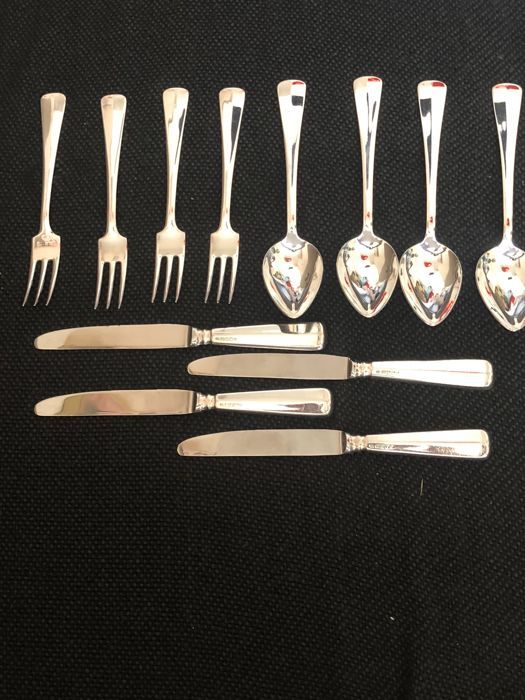
You are a GUI agent. You are given a task and a screenshot of the screen. Output one action in this format:
    pyautogui.click(x=<x>, y=<y>)
    Task: Click on the knives
    The width and height of the screenshot is (525, 700).
    Given the screenshot: What is the action you would take?
    pyautogui.click(x=131, y=396), pyautogui.click(x=253, y=446), pyautogui.click(x=270, y=369), pyautogui.click(x=160, y=343)